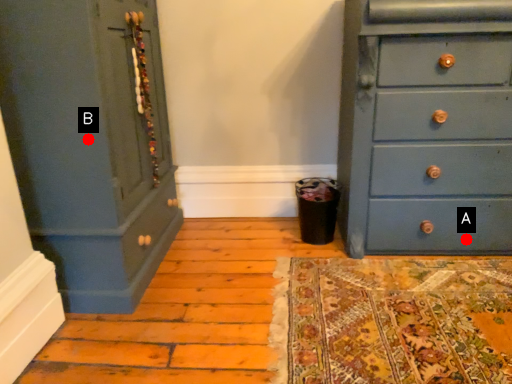
Question: Two points are circled on the image, labeled by A and B beside each circle. Which point is closer to the camera?

Choices:
 (A) A is closer
 (B) B is closer

Answer: (B)